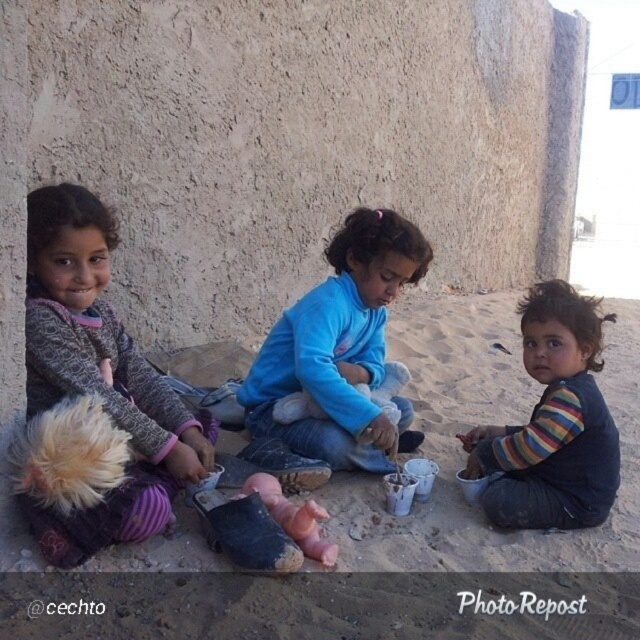
Question: Which point appears farthest from the camera in this image?

Choices:
 (A) (90, 257)
 (B) (339, 372)

Answer: (B)

Question: Does brown sandy ground at center have a lesser width compared to striped fabric shirt at center?

Choices:
 (A) yes
 (B) no

Answer: (B)

Question: Which of the following is the closest to the observer?

Choices:
 (A) (77, 236)
 (B) (392, 275)
 (C) (614, 320)
 (D) (616, 381)

Answer: (A)

Question: Observing the image, what is the correct spatial positioning of brown sandy ground at center in reference to knitted gray sweater at left?

Choices:
 (A) below
 (B) above

Answer: (A)

Question: Which of the following is the closest to the observer?

Choices:
 (A) (346, 412)
 (B) (52, 276)

Answer: (B)

Question: Does blue fleece jacket at center lie in front of knitted gray sweater at left?

Choices:
 (A) no
 (B) yes

Answer: (A)